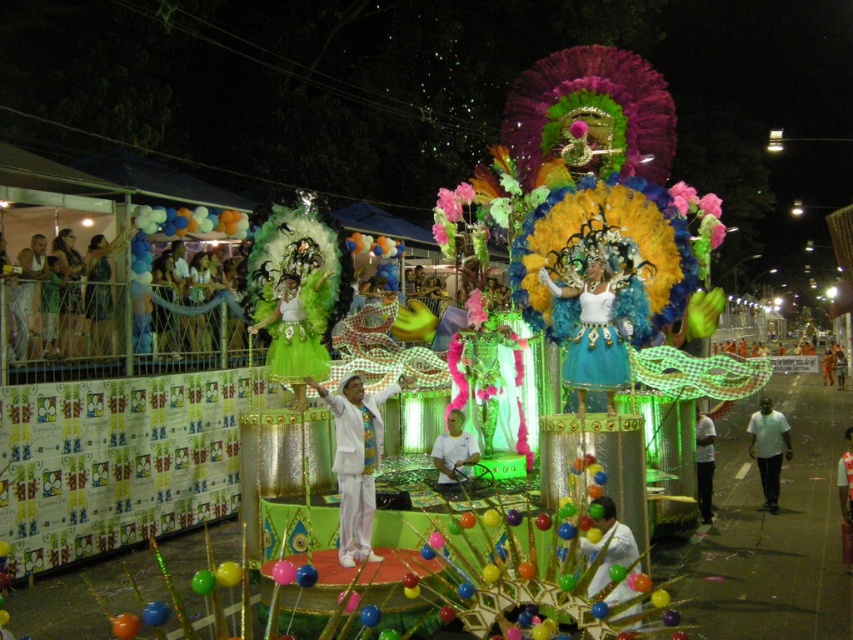
You are a photographer at the carnival trying to capture the float with both the white fabric shirt at left and the white cotton shirt at center in the frame. Which shirt should you focus on first to ensure both are in the shot?

The white fabric shirt at left is to the left of the white cotton shirt at center, so you should focus on the white cotton shirt at center first to ensure both are in the shot.

You are attending the carnival and want to compare the clothing items you see. Which clothing item, the white matte shirt at lower right or the white satin dress at center, is bigger in size?

The white matte shirt at lower right is larger in size compared to the white satin dress at center.

You are a photographer at the carnival and want to capture both the white fabric at center and the white satin dress at center in a single frame. Which object should you focus on first to ensure both are in the frame?

The white fabric at center has a lesser width compared to the white satin dress at center, so you should focus on the wider white satin dress at center first to ensure both objects fit within the frame.